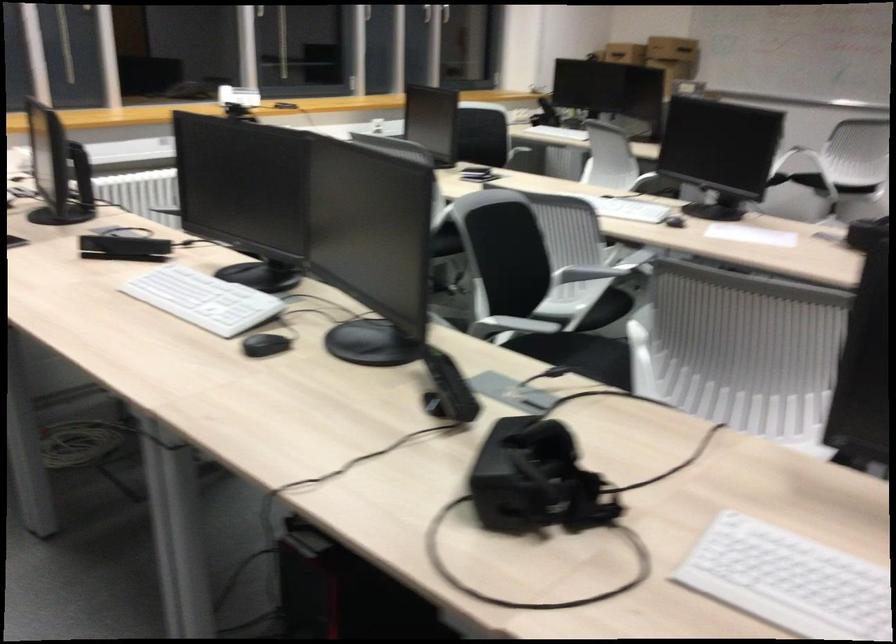
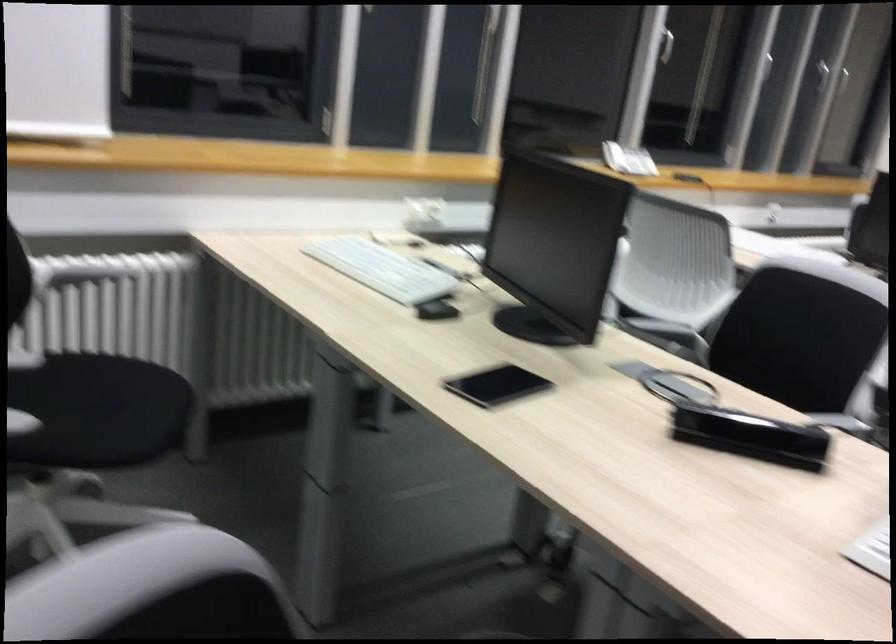
The images are taken continuously from a first-person perspective. In which direction are you moving?

The cameraman walked toward left, forward.